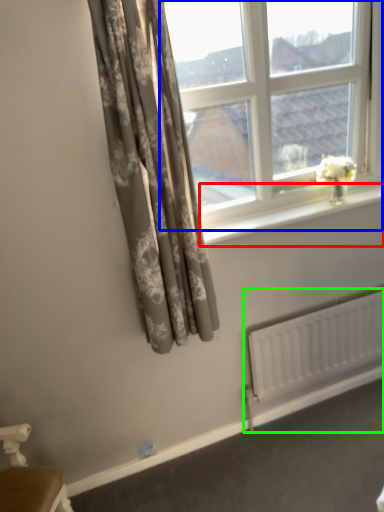
Question: Estimate the real-world distances between objects in this image. Which object is farther from window sill (highlighted by a red box), window (highlighted by a blue box) or radiator (highlighted by a green box)?

Choices:
 (A) window
 (B) radiator

Answer: (B)